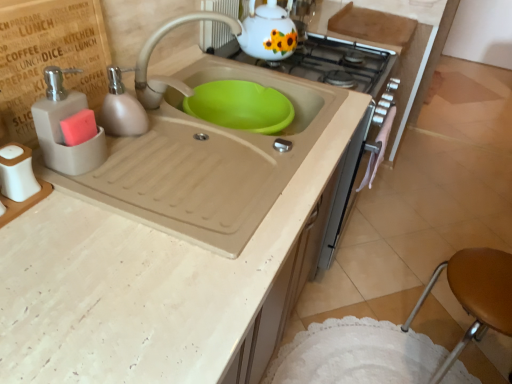
Locate an element on the screen. beige matte sink at center is located at coordinates (205, 161).

Find the location of a particular element. The image size is (512, 384). white matte salt shaker at left is located at coordinates (17, 172).

Where is `white ceramic teapot at upper center`? The height and width of the screenshot is (384, 512). white ceramic teapot at upper center is located at coordinates (268, 32).

Which object is more forward, white matte salt shaker at left or white ceramic teapot at upper center?

white matte salt shaker at left is in front.

In terms of size, does white matte salt shaker at left appear bigger or smaller than white ceramic teapot at upper center?

Clearly, white matte salt shaker at left is smaller in size than white ceramic teapot at upper center.

Which is farther from the camera, (x=4, y=191) or (x=283, y=14)?

The point (x=283, y=14) is more distant.

Does white matte salt shaker at left touch white ceramic teapot at upper center?

No, white matte salt shaker at left is not next to white ceramic teapot at upper center.

Which is behind, matte gray soap dispenser at left or beige matte sink at center?

beige matte sink at center is behind.

Identify the location of plywood above the beige matte sink at center (from a real-world perspective). (48, 58).

Is matte gray soap dispenser at left placed right next to beige matte sink at center?

They are not placed beside each other.

Is brown leather stool at lower right oriented away from beige matte sink at center?

No, brown leather stool at lower right is not facing away from beige matte sink at center.

In the scene shown: Considering the positions of objects brown leather stool at lower right and beige matte sink at center in the image provided, who is behind, brown leather stool at lower right or beige matte sink at center?

Positioned behind is brown leather stool at lower right.

Is brown leather stool at lower right smaller than beige matte sink at center?

Correct, brown leather stool at lower right occupies less space than beige matte sink at center.

From the image's perspective, does brown leather stool at lower right appear higher than beige matte sink at center?

Actually, brown leather stool at lower right appears below beige matte sink at center in the image.

You are a GUI agent. You are given a task and a screenshot of the screen. Output one action in this format:
    pyautogui.click(x=<x>, y=<y>)
    Task: Click on the tea pot located above the brown leather stool at lower right (from the image's perspective)
    The image size is (512, 384).
    Given the screenshot: What is the action you would take?
    pyautogui.click(x=268, y=32)

Between brown leather stool at lower right and white ceramic teapot at upper center, which one is positioned in front?

brown leather stool at lower right.

Does brown leather stool at lower right appear on the right side of white ceramic teapot at upper center?

Yes.

From a real-world perspective, between beige matte sink at center and matte gray soap dispenser at left, the 2th soap dispenser positioned from the back, who is vertically higher?

matte gray soap dispenser at left, the 2th soap dispenser positioned from the back.

Which object is more forward, beige matte sink at center or matte gray soap dispenser at left, the 2th soap dispenser positioned from the back?

beige matte sink at center is in front.

This screenshot has height=384, width=512. I want to click on sink below the matte gray soap dispenser at left, which appears as the 1th soap dispenser when viewed from the front (from the image's perspective), so click(x=205, y=161).

In the image, is beige matte sink at center on the left side or the right side of matte gray soap dispenser at left, the 2th soap dispenser positioned from the back?

From the image, it's evident that beige matte sink at center is to the right of matte gray soap dispenser at left, the 2th soap dispenser positioned from the back.

Which is closer to the camera, (265, 19) or (11, 155)?

Positioned in front is point (11, 155).

From the image's perspective, is white ceramic teapot at upper center over white matte salt shaker at left?

Correct, white ceramic teapot at upper center appears higher than white matte salt shaker at left in the image.

Can you confirm if white ceramic teapot at upper center is positioned to the right of white matte salt shaker at left?

Yes, white ceramic teapot at upper center is to the right of white matte salt shaker at left.

Based on the photo, how different are the orientations of white ceramic teapot at upper center and white matte salt shaker at left in degrees?

They differ by 0.669 degrees in their facing directions.

Which is nearer, (357,45) or (232,20)?

Point (357,45) is positioned farther from the camera compared to point (232,20).

Is there a large distance between white glossy gas stove at upper center and matte beige faucet at sink center?

white glossy gas stove at upper center is actually quite close to matte beige faucet at sink center.

Can matte beige faucet at sink center be found inside white glossy gas stove at upper center?

No, matte beige faucet at sink center is not surrounded by white glossy gas stove at upper center.

From a real-world perspective, who is located lower, white glossy gas stove at upper center or matte beige faucet at sink center?

white glossy gas stove at upper center, from a real-world perspective.

The image size is (512, 384). Find the location of `salt shaker below the white ceramic teapot at upper center (from the image's perspective)`. salt shaker below the white ceramic teapot at upper center (from the image's perspective) is located at coordinates (17, 172).

The height and width of the screenshot is (384, 512). In order to click on plywood on the left of the beige matte sink at center in this screenshot , I will do `click(48, 58)`.

Which object lies further to the anchor point white ceramic teapot at upper center, beige matte sink at center or matte gray soap dispenser at left, which appears as the 1th soap dispenser when viewed from the front?

matte gray soap dispenser at left, which appears as the 1th soap dispenser when viewed from the front, is further to white ceramic teapot at upper center.

When comparing their distances from white matte salt shaker at left, does matte gray soap dispenser at left or matte beige soap dispenser at left, which is the first soap dispenser in back-to-front order, seem closer?

Among the two, matte gray soap dispenser at left is located nearer to white matte salt shaker at left.

Which object lies further to the anchor point matte beige soap dispenser at left, which is the first soap dispenser in back-to-front order, brown leather stool at lower right or matte beige faucet at sink center?

brown leather stool at lower right lies further to matte beige soap dispenser at left, which is the first soap dispenser in back-to-front order, than the other object.

Looking at the image, which one is located closer to white glossy gas stove at upper center, beige matte sink at center or matte gray soap dispenser at left?

beige matte sink at center.

Estimate the real-world distances between objects in this image. Which object is further from white matte salt shaker at left, matte gray soap dispenser at left or beige matte sink at center?

Among the two, beige matte sink at center is located further to white matte salt shaker at left.

Considering their positions, is matte beige faucet at sink center positioned closer to white glossy gas stove at upper center than matte beige soap dispenser at left, which is the first soap dispenser in back-to-front order?

matte beige faucet at sink center lies closer to white glossy gas stove at upper center than the other object.

When comparing their distances from white glossy gas stove at upper center, does matte gray soap dispenser at left, the 2th soap dispenser positioned from the back, or brown leather stool at lower right seem further?

Among the two, matte gray soap dispenser at left, the 2th soap dispenser positioned from the back, is located further to white glossy gas stove at upper center.

Looking at the image, which one is located further to matte gray soap dispenser at left, white glossy gas stove at upper center or matte beige faucet at sink center?

Based on the image, white glossy gas stove at upper center appears to be further to matte gray soap dispenser at left.

Image resolution: width=512 pixels, height=384 pixels. I want to click on salt shaker between matte gray soap dispenser at left and white ceramic teapot at upper center from front to back, so click(17, 172).

At what (x,y) coordinates should I click in order to perform the action: click on soap dispenser between matte gray soap dispenser at left, which appears as the 1th soap dispenser when viewed from the front, and white ceramic teapot at upper center in the front-back direction. Please return your answer as a coordinate pair (x, y). This screenshot has width=512, height=384. Looking at the image, I should click on (122, 107).

Locate an element on the screen. The width and height of the screenshot is (512, 384). tap positioned between matte gray soap dispenser at left, the 2th soap dispenser positioned from the back, and white ceramic teapot at upper center from near to far is located at coordinates (166, 76).

The height and width of the screenshot is (384, 512). I want to click on sink located between matte gray soap dispenser at left and brown leather stool at lower right in the left-right direction, so click(205, 161).